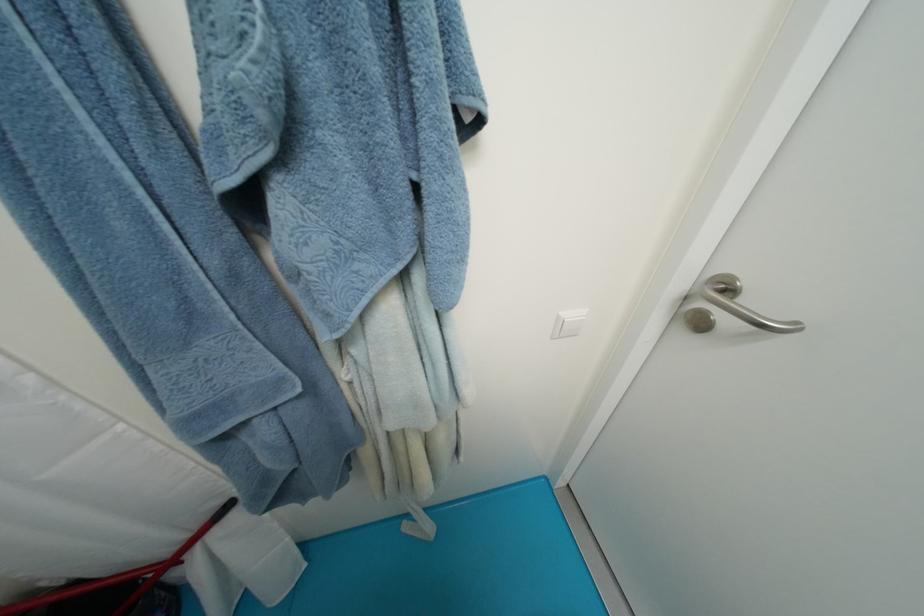
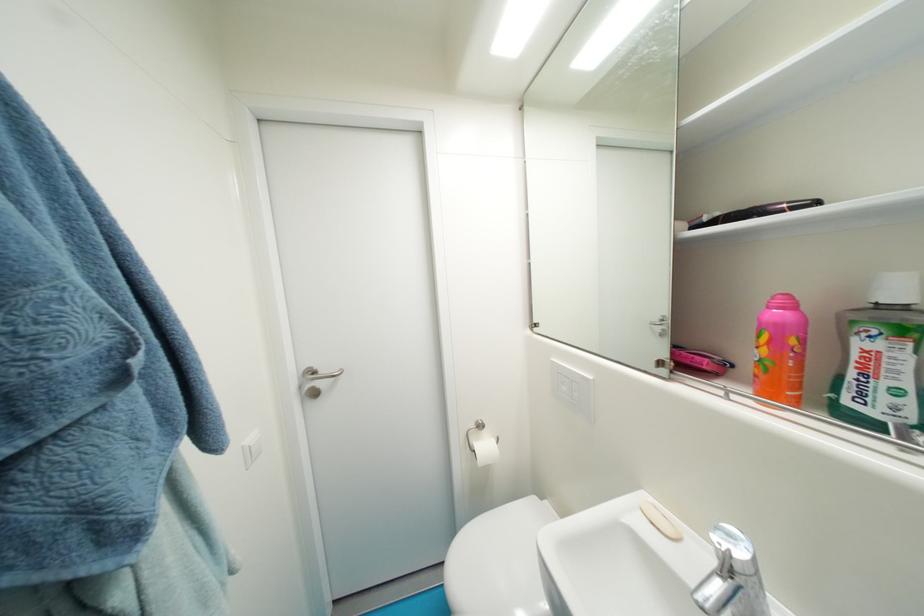
Locate, in the second image, the point that corresponds to the point at 736,293 in the first image.

(322, 374)